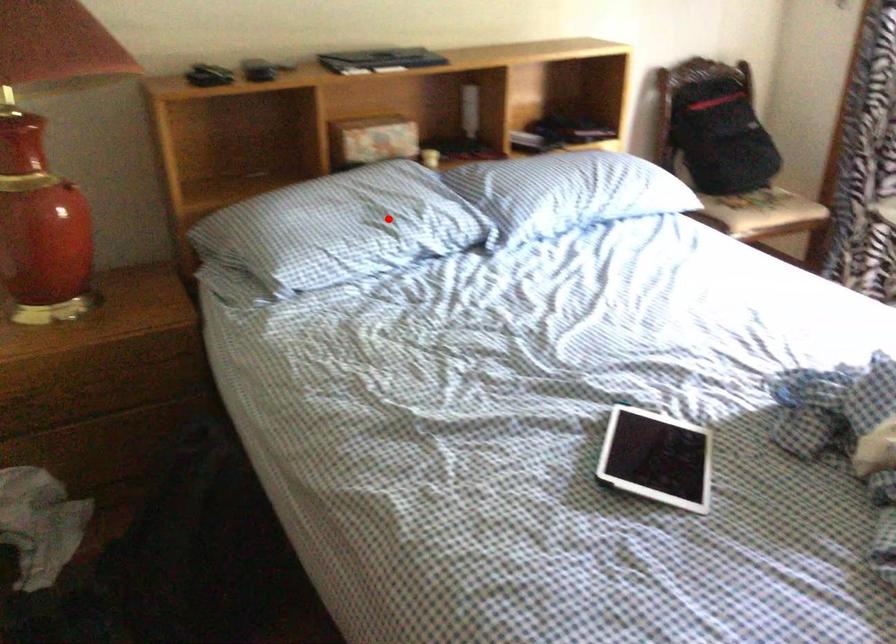
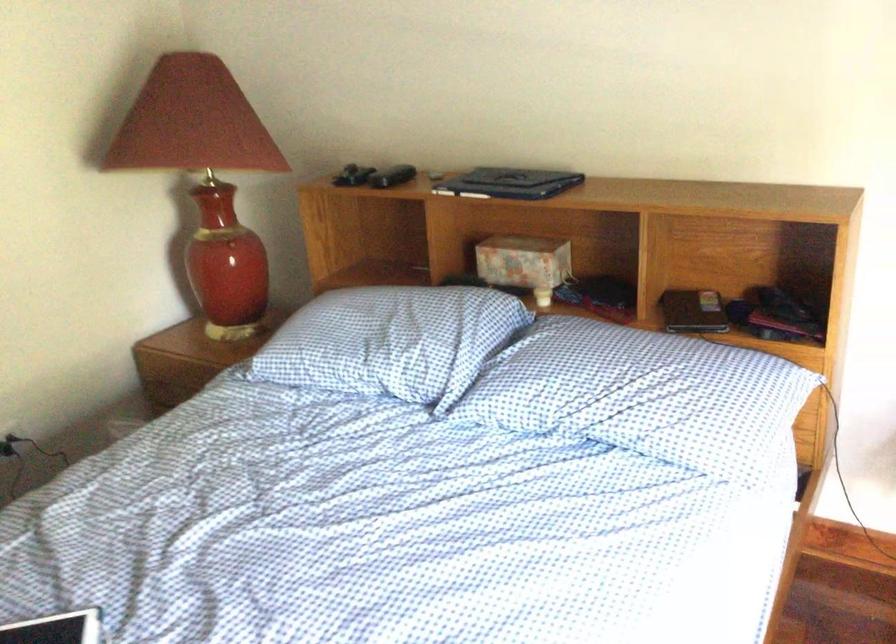
Question: I am providing you with two images of the same scene from different viewpoints. A red point is marked on the first image. Is the red point's position out of view in image 2?

Choices:
 (A) Yes
 (B) No

Answer: (B)